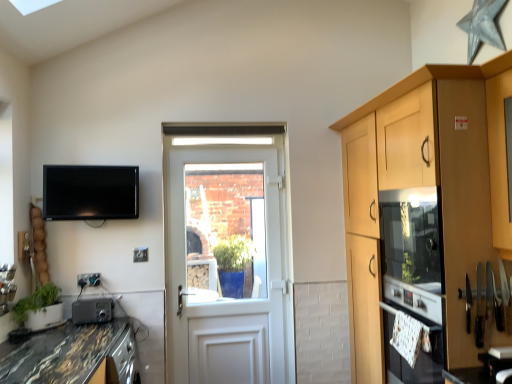
This screenshot has height=384, width=512. Describe the element at coordinates (92, 311) in the screenshot. I see `metallic gray radio at lower left` at that location.

I want to click on matte wood oven at right, so click(426, 216).

You are a GUI agent. You are given a task and a screenshot of the screen. Output one action in this format:
    pyautogui.click(x=<x>, y=<y>)
    Task: Click on the clear glass door at center
    Image resolution: width=512 pixels, height=384 pixels.
    Given the screenshot: What is the action you would take?
    pyautogui.click(x=226, y=228)

What do you see at coordinates (73, 355) in the screenshot? Image resolution: width=512 pixels, height=384 pixels. I see `marble/black granite countertop at lower left` at bounding box center [73, 355].

In order to click on metallic gray radio at lower left in this screenshot , I will do `click(92, 311)`.

From the image's perspective, is matte black tv at upper left on top of marble/black granite countertop at lower left?

Yes, from the image's perspective, matte black tv at upper left is on top of marble/black granite countertop at lower left.

Find the location of a particular element. The width and height of the screenshot is (512, 384). countertop that is in front of the matte black tv at upper left is located at coordinates (73, 355).

In terms of width, does matte black tv at upper left look wider or thinner when compared to marble/black granite countertop at lower left?

In the image, matte black tv at upper left appears to be more narrow than marble/black granite countertop at lower left.

Who is smaller, matte black tv at upper left or marble/black granite countertop at lower left?

With smaller size is matte black tv at upper left.

From the image's perspective, who appears lower, matte wood oven at right or clear glass door at center?

matte wood oven at right, from the image's perspective.

Which is closer, (481, 99) or (224, 263)?

The point (481, 99) is more forward.

Who is shorter, matte wood oven at right or clear glass door at center?

Standing shorter between the two is clear glass door at center.

In the image, is matte wood oven at right on the left side or the right side of metallic gray radio at lower left?

Based on their positions, matte wood oven at right is located to the right of metallic gray radio at lower left.

Does point (362, 325) come farther from viewer compared to point (88, 310)?

No, (362, 325) is closer to viewer.

Between matte wood oven at right and metallic gray radio at lower left, which one has more height?

Standing taller between the two is matte wood oven at right.

From the image's perspective, relative to metallic gray radio at lower left, is matte wood oven at right above or below?

Clearly, from the image's perspective, matte wood oven at right is above metallic gray radio at lower left.

Relative to matte wood oven at right, is marble/black granite countertop at lower left in front or behind?

In the image, marble/black granite countertop at lower left appears behind matte wood oven at right.

Considering the points (9, 373) and (403, 252), which point is in front, point (9, 373) or point (403, 252)?

The point (9, 373) is in front.

Can you confirm if marble/black granite countertop at lower left is taller than matte wood oven at right?

Incorrect, the height of marble/black granite countertop at lower left is not larger of that of matte wood oven at right.

Is white glossy oven at lower right facing towards metallic gray radio at lower left?

No.

Based on the photo, between white glossy oven at lower right and metallic gray radio at lower left, which one has more height?

With more height is white glossy oven at lower right.

Considering the sizes of objects white glossy oven at lower right and metallic gray radio at lower left in the image provided, who is smaller, white glossy oven at lower right or metallic gray radio at lower left?

white glossy oven at lower right is smaller.

Is marble/black granite countertop at lower left to the right of green matte plant at lower left from the viewer's perspective?

Indeed, marble/black granite countertop at lower left is positioned on the right side of green matte plant at lower left.

Identify the location of houseplant on the left of marble/black granite countertop at lower left. The height and width of the screenshot is (384, 512). (40, 308).

Does marble/black granite countertop at lower left contain green matte plant at lower left?

No, green matte plant at lower left is not surrounded by marble/black granite countertop at lower left.

Does matte wood oven at right contain marble/black granite countertop at lower left?

No, marble/black granite countertop at lower left is not inside matte wood oven at right.

Where is `countertop located behind the matte wood oven at right`? countertop located behind the matte wood oven at right is located at coordinates (73, 355).

Is matte wood oven at right further to camera compared to marble/black granite countertop at lower left?

No, the depth of matte wood oven at right is less than that of marble/black granite countertop at lower left.

The width and height of the screenshot is (512, 384). I want to click on television above the marble/black granite countertop at lower left (from a real-world perspective), so click(x=90, y=192).

This screenshot has height=384, width=512. Find the location of `window screen on the left of matte wood oven at right`. window screen on the left of matte wood oven at right is located at coordinates (226, 228).

Based on their spatial positions, is metallic gray radio at lower left or white glossy oven at lower right closer to green matte plant at lower left?

metallic gray radio at lower left is positioned closer to the anchor green matte plant at lower left.

Which object lies nearer to the anchor point clear glass door at center, matte black tv at upper left or matte wood oven at right?

Based on the image, matte black tv at upper left appears to be nearer to clear glass door at center.

Which object lies further to the anchor point matte black tv at upper left, white glossy oven at lower right or green matte plant at lower left?

Among the two, white glossy oven at lower right is located further to matte black tv at upper left.

Looking at the image, which one is located further to matte black tv at upper left, white glossy oven at lower right or matte wood oven at right?

white glossy oven at lower right is positioned further to the anchor matte black tv at upper left.

Which object lies further to the anchor point marble/black granite countertop at lower left, metallic gray radio at lower left or green matte plant at lower left?

metallic gray radio at lower left is further to marble/black granite countertop at lower left.

Estimate the real-world distances between objects in this image. Which object is closer to white glossy oven at lower right, marble/black granite countertop at lower left or metallic gray radio at lower left?

Based on the image, marble/black granite countertop at lower left appears to be nearer to white glossy oven at lower right.

When comparing their distances from matte black tv at upper left, does green matte plant at lower left or metallic gray radio at lower left seem closer?

green matte plant at lower left lies closer to matte black tv at upper left than the other object.

Based on their spatial positions, is green matte plant at lower left or clear glass door at center closer to matte black tv at upper left?

green matte plant at lower left.

You are a GUI agent. You are given a task and a screenshot of the screen. Output one action in this format:
    pyautogui.click(x=<x>, y=<y>)
    Task: Click on the countertop situated between green matte plant at lower left and clear glass door at center from left to right
    
    Given the screenshot: What is the action you would take?
    pyautogui.click(x=73, y=355)

Locate an element on the screen. television located between green matte plant at lower left and white glossy oven at lower right in the left-right direction is located at coordinates (90, 192).

Where is `countertop between green matte plant at lower left and white glossy oven at lower right from left to right`? countertop between green matte plant at lower left and white glossy oven at lower right from left to right is located at coordinates (73, 355).

You are a GUI agent. You are given a task and a screenshot of the screen. Output one action in this format:
    pyautogui.click(x=<x>, y=<y>)
    Task: Click on the oven between matte black tv at upper left and matte wood oven at right in the horizontal direction
    
    Given the screenshot: What is the action you would take?
    pyautogui.click(x=419, y=352)